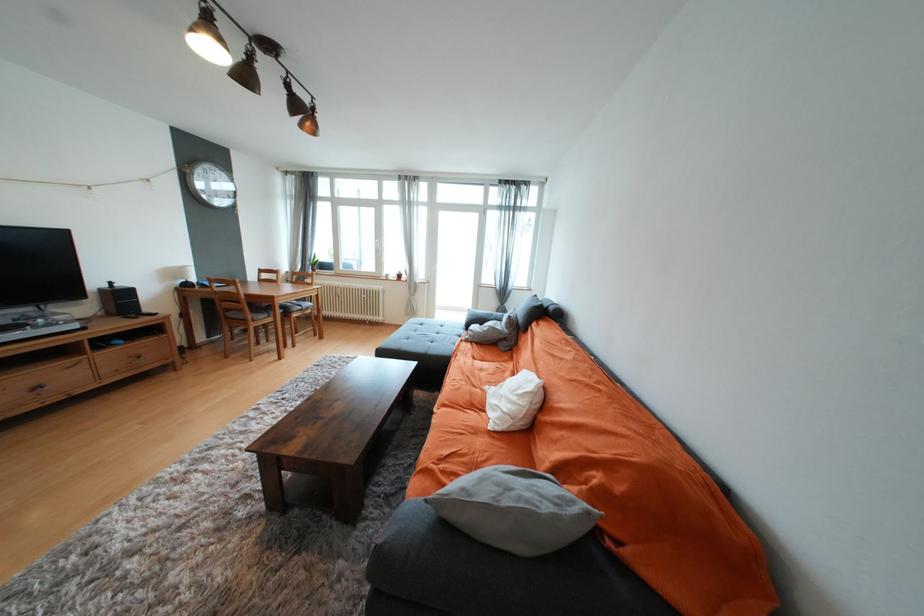
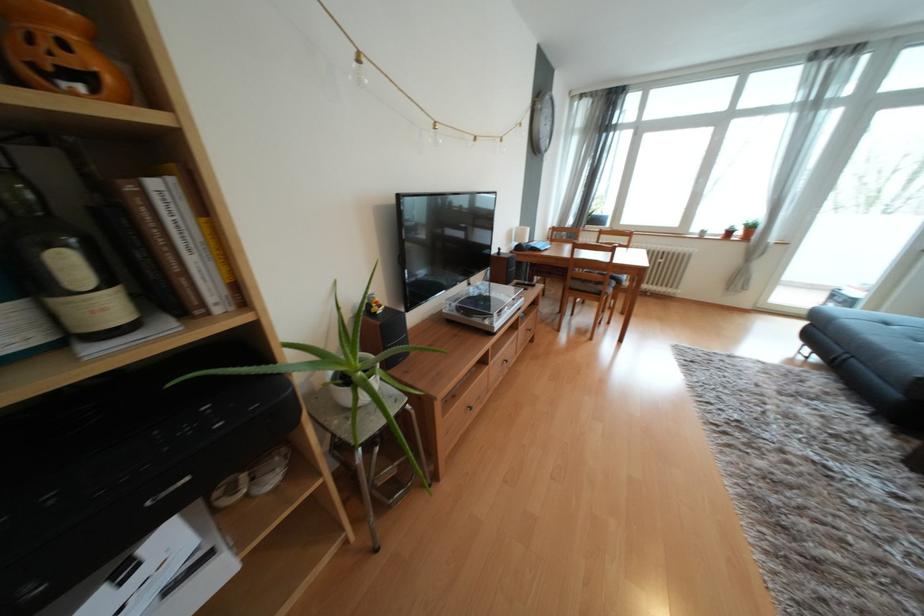
Question: Which direction would the cameraman need to move to produce the second image? Reply with the corresponding letter.

Choices:
 (A) Left
 (B) Right
 (C) Forward
 (D) Backward

Answer: (A)